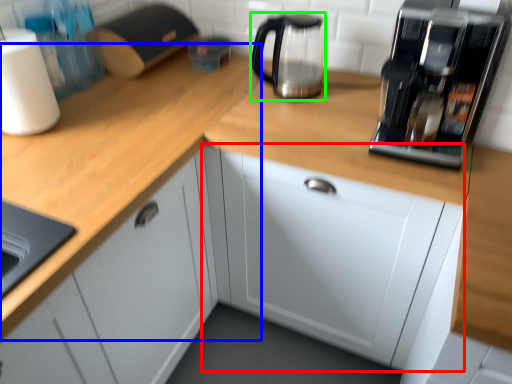
Question: Based on their relative distances, which object is farther from cabinetry (highlighted by a red box)? Choose from countertop (highlighted by a blue box) and kitchen appliance (highlighted by a green box).

Choices:
 (A) countertop
 (B) kitchen appliance

Answer: (B)